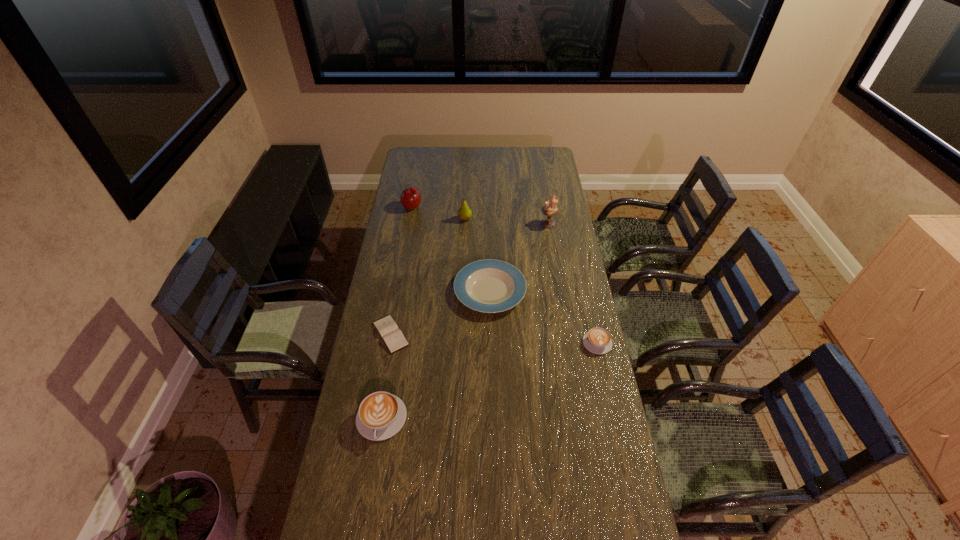
Where is `blank area at the near right corner`? blank area at the near right corner is located at coordinates (599, 494).

Where is `blank region between the sixth object from left to right and the farther cappuccino`? This screenshot has width=960, height=540. blank region between the sixth object from left to right and the farther cappuccino is located at coordinates (573, 283).

Locate an element on the screen. The image size is (960, 540). free space that is in between the right cappuccino and the pear is located at coordinates (531, 281).

Find the location of a particular element. The width and height of the screenshot is (960, 540). vacant space that is in between the fourth tallest object and the tallest object is located at coordinates (465, 321).

I want to click on blank region between the left cappuccino and the farther cappuccino, so click(490, 380).

Where is `blank region between the shorter cappuccino and the pear`? The image size is (960, 540). blank region between the shorter cappuccino and the pear is located at coordinates (531, 281).

Where is `vacant area between the shortest object and the farther cappuccino`? Image resolution: width=960 pixels, height=540 pixels. vacant area between the shortest object and the farther cappuccino is located at coordinates (493, 338).

I want to click on free spot between the fourth shortest object and the tallest object, so click(465, 321).

Where is `free area in between the apple and the plate`? This screenshot has width=960, height=540. free area in between the apple and the plate is located at coordinates (451, 248).

Where is `free spot between the taller cappuccino and the shorter cappuccino`? This screenshot has height=540, width=960. free spot between the taller cappuccino and the shorter cappuccino is located at coordinates (490, 380).